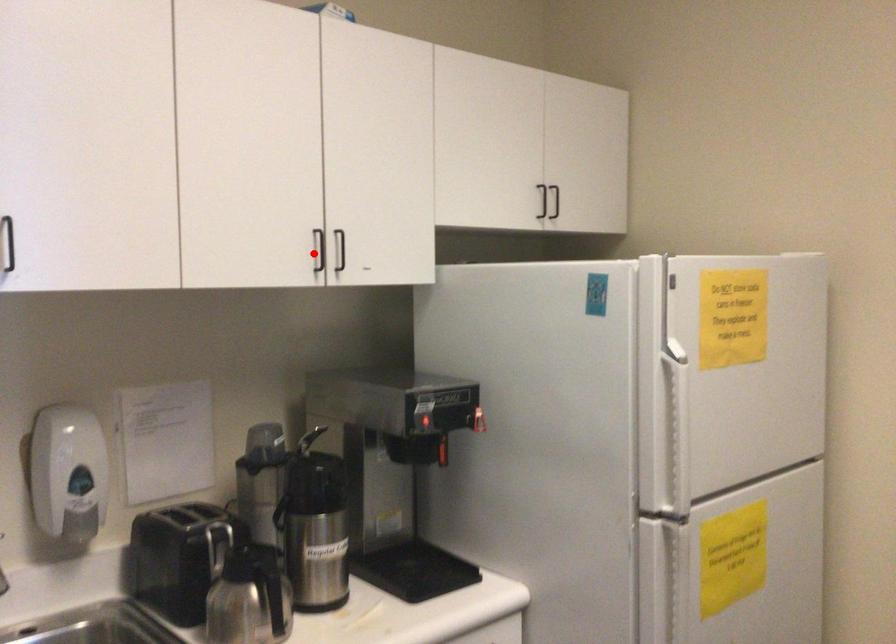
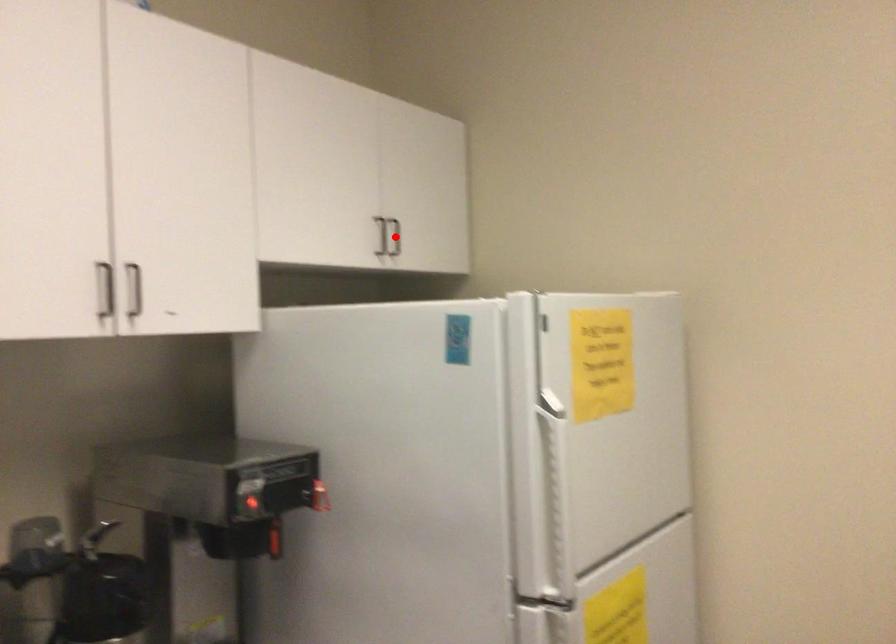
From the picture: I am providing you with two images of the same scene from different viewpoints. A red point is marked on the first image and another point is marked on the second image. Are the points marked in image1 and image2 representing the same 3D position?

No